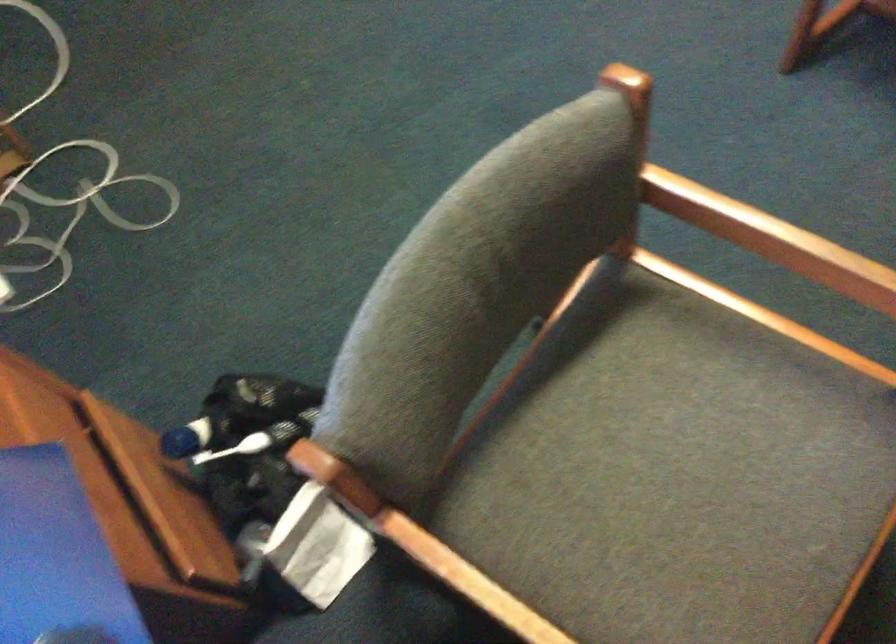
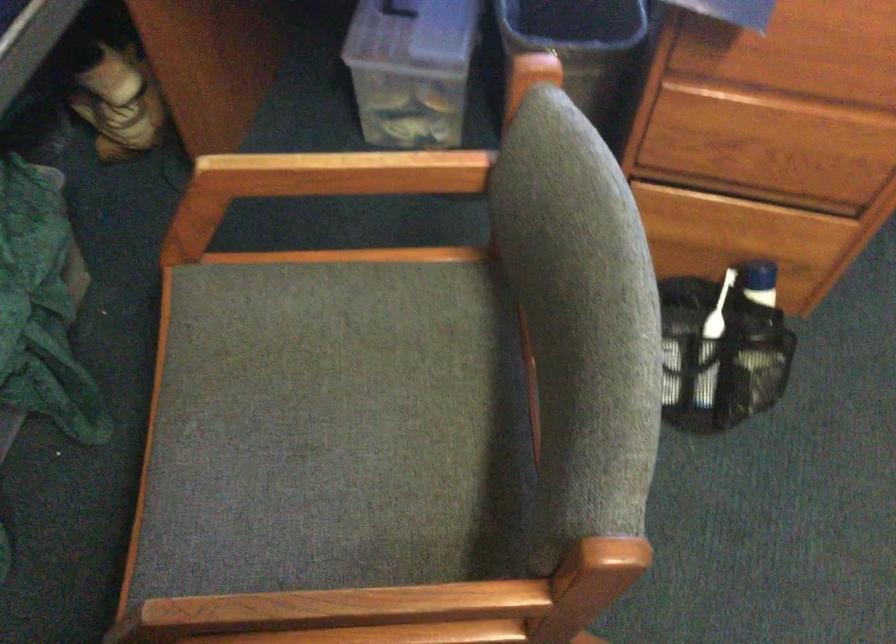
Find the pixel in the second image that matches pixel 93 504 in the first image.

(751, 147)